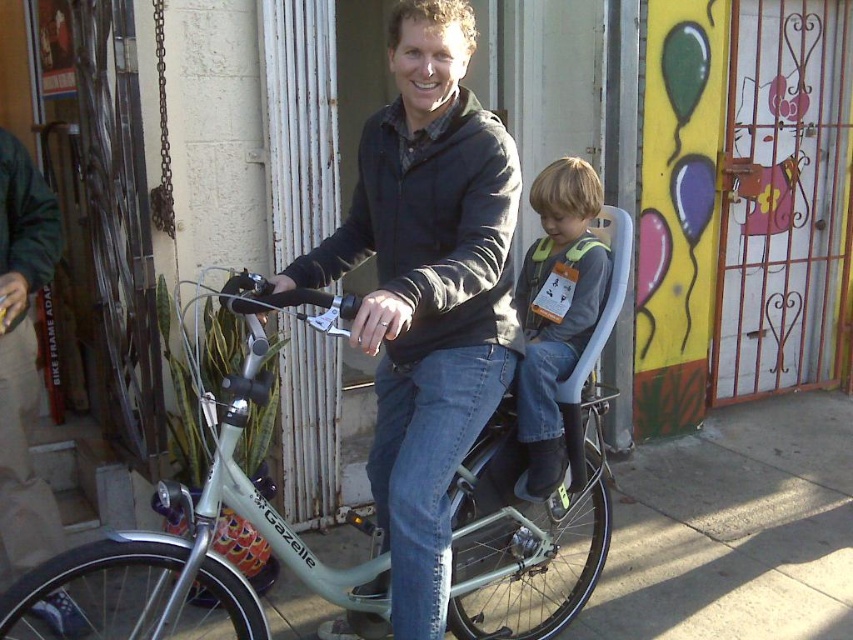
In the scene shown: Between matte gray jacket at center and matte silver bicycle at center, which one is positioned higher?

Positioned higher is matte gray jacket at center.

Who is lower down, matte gray jacket at center or matte silver bicycle at center?

matte silver bicycle at center is below.

This screenshot has width=853, height=640. What do you see at coordinates (427, 291) in the screenshot?
I see `matte gray jacket at center` at bounding box center [427, 291].

Image resolution: width=853 pixels, height=640 pixels. Identify the location of matte gray jacket at center. click(427, 291).

Does matte gray jacket at center have a smaller size compared to gray-green fabric vest at center?

Incorrect, matte gray jacket at center is not smaller in size than gray-green fabric vest at center.

Who is more forward, (422, 465) or (573, 282)?

Point (422, 465) is in front.

What are the coordinates of `matte gray jacket at center` in the screenshot? It's located at (427, 291).

Which is more to the right, matte silver bicycle at center or gray-green fabric vest at center?

gray-green fabric vest at center is more to the right.

From the picture: Does matte silver bicycle at center have a larger size compared to gray-green fabric vest at center?

Yes, matte silver bicycle at center is bigger than gray-green fabric vest at center.

Does point (305, 548) lie in front of point (556, 236)?

Yes, point (305, 548) is closer to viewer.

You are a GUI agent. You are given a task and a screenshot of the screen. Output one action in this format:
    pyautogui.click(x=<x>, y=<y>)
    Task: Click on the matte silver bicycle at center
    The width and height of the screenshot is (853, 640).
    Given the screenshot: What is the action you would take?
    pyautogui.click(x=216, y=500)